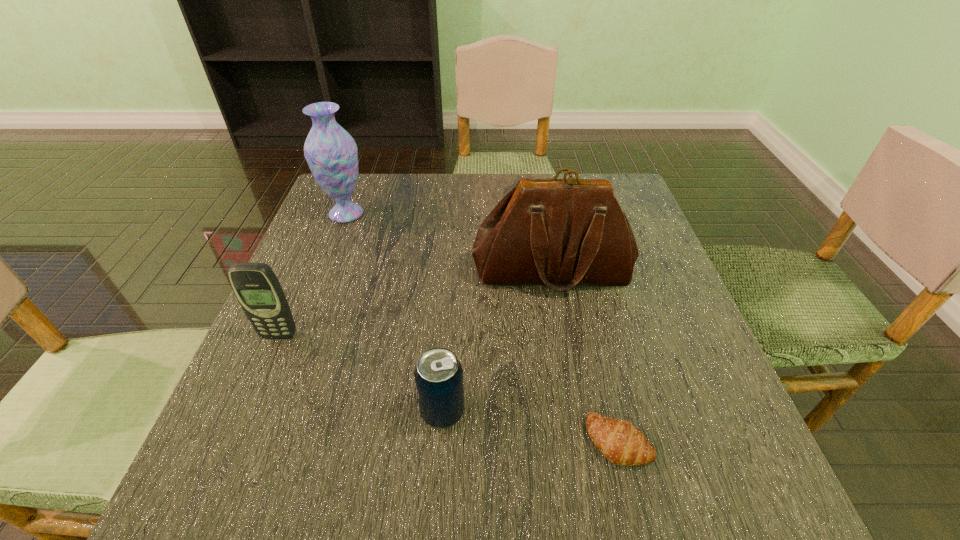
The height and width of the screenshot is (540, 960). I want to click on vacant region located on the back of the third object from left to right, so click(450, 302).

At what (x,y) coordinates should I click in order to perform the action: click on vacant space located on the back of the shortest object. Please return your answer as a coordinate pair (x, y). This screenshot has width=960, height=540. Looking at the image, I should click on (581, 283).

At what (x,y) coordinates should I click in order to perform the action: click on object present at the far edge. Please return your answer as a coordinate pair (x, y). Looking at the image, I should click on (331, 152).

Where is `object at the near edge`? The image size is (960, 540). object at the near edge is located at coordinates (620, 442).

Image resolution: width=960 pixels, height=540 pixels. I want to click on vase situated at the left edge, so click(331, 152).

Find the location of a particular element. This screenshot has height=540, width=960. cellular telephone present at the left edge is located at coordinates (256, 287).

Where is `shoulder bag positioned at the right edge`? shoulder bag positioned at the right edge is located at coordinates (561, 233).

You are a GUI agent. You are given a task and a screenshot of the screen. Output one action in this format:
    pyautogui.click(x=<x>, y=<y>)
    Task: Click on the crescent roll that is at the right edge
    
    Given the screenshot: What is the action you would take?
    pyautogui.click(x=620, y=442)

Locate an element on the screen. object at the far left corner is located at coordinates (331, 152).

At what (x,y) coordinates should I click in order to perform the action: click on object present at the near right corner. Please return your answer as a coordinate pair (x, y). This screenshot has height=540, width=960. Looking at the image, I should click on (620, 442).